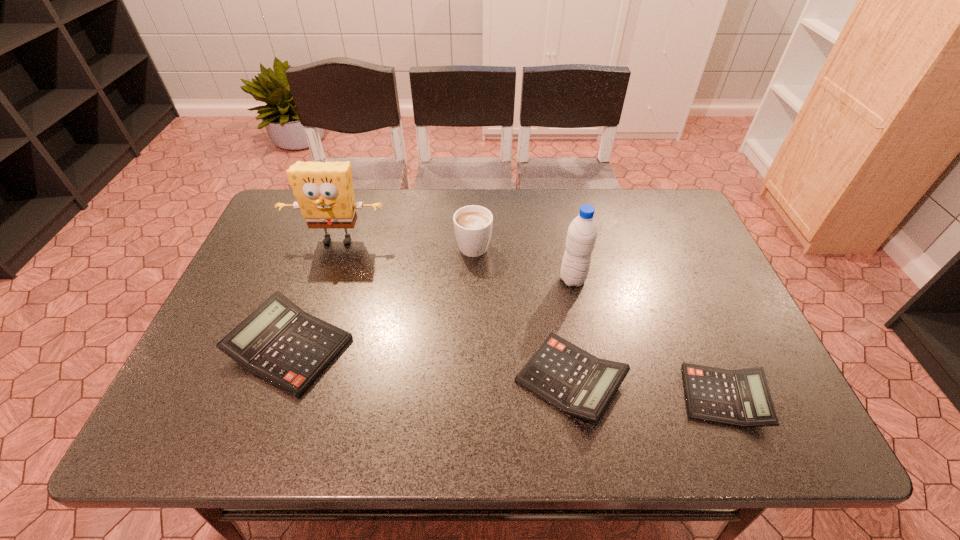
The width and height of the screenshot is (960, 540). I want to click on calculator that can be found as the second closest to the third tallest object, so click(x=280, y=343).

This screenshot has width=960, height=540. I want to click on the closest calculator to the leftmost calculator, so click(x=569, y=378).

Locate an element on the screen. vacant area in the image that satisfies the following two spatial constraints: 1. on the front side of the leftmost calculator; 2. on the left side of the shortest calculator is located at coordinates (272, 397).

Locate an element on the screen. free location that satisfies the following two spatial constraints: 1. on the front side of the leftmost calculator; 2. on the left side of the shortest calculator is located at coordinates (272, 397).